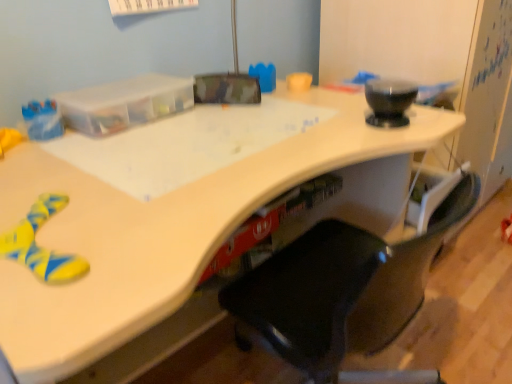
What do you see at coordinates (341, 289) in the screenshot? Image resolution: width=512 pixels, height=384 pixels. I see `black plastic chair at center` at bounding box center [341, 289].

Locate an element on the screen. white glossy desk at lower left is located at coordinates (165, 213).

Which of these two, white glossy desk at lower left or rubberized red toy at lower right, is smaller?

rubberized red toy at lower right.

From the picture: Are white glossy desk at lower left and rubberized red toy at lower right making contact?

They are not placed beside each other.

From the image's perspective, which is below, white glossy desk at lower left or rubberized red toy at lower right?

white glossy desk at lower left is shown below in the image.

From a real-world perspective, between rubberized red toy at lower right and black plastic chair at center, who is vertically lower?

rubberized red toy at lower right.

Which is in front, rubberized red toy at lower right or black plastic chair at center?

Positioned in front is black plastic chair at center.

Considering the points (504, 221) and (330, 263), which point is in front, point (504, 221) or point (330, 263)?

Point (330, 263)

How distant is rubberized red toy at lower right from black plastic chair at center?

rubberized red toy at lower right is 1.27 meters away from black plastic chair at center.

Is black plastic chair at center at the right side of white glossy desk at lower left?

No, black plastic chair at center is not to the right of white glossy desk at lower left.

Can you confirm if black plastic chair at center is shorter than white glossy desk at lower left?

In fact, black plastic chair at center may be taller than white glossy desk at lower left.

The image size is (512, 384). Find the location of `desk below the black plastic chair at center (from the image's perspective)`. desk below the black plastic chair at center (from the image's perspective) is located at coordinates (165, 213).

How many degrees apart are the facing directions of black plastic chair at center and white glossy desk at lower left?

The angular difference between black plastic chair at center and white glossy desk at lower left is 94 degrees.

Based on their sizes in the image, would you say rubberized red toy at lower right is bigger or smaller than white glossy desk at lower left?

In the image, rubberized red toy at lower right appears to be smaller than white glossy desk at lower left.

Is white glossy desk at lower left a part of rubberized red toy at lower right?

Actually, white glossy desk at lower left is outside rubberized red toy at lower right.

Is rubberized red toy at lower right to the left of white glossy desk at lower left from the viewer's perspective?

In fact, rubberized red toy at lower right is to the right of white glossy desk at lower left.

Identify the location of desk below the rubberized red toy at lower right (from the image's perspective). The width and height of the screenshot is (512, 384). (165, 213).

How many degrees apart are the facing directions of black plastic chair at center and rubberized red toy at lower right?

The facing directions of black plastic chair at center and rubberized red toy at lower right are 107 degrees apart.

Could rubberized red toy at lower right be considered to be inside black plastic chair at center?

Actually, rubberized red toy at lower right is outside black plastic chair at center.

Is black plastic chair at center to the right of rubberized red toy at lower right from the viewer's perspective?

In fact, black plastic chair at center is to the left of rubberized red toy at lower right.

Which point is more forward, (259, 296) or (507, 238)?

The point (259, 296) is closer.

In order to click on desk that is under the black plastic chair at center (from a real-world perspective) in this screenshot , I will do `click(165, 213)`.

From the image's perspective, is white glossy desk at lower left positioned above or below black plastic chair at center?

white glossy desk at lower left is below black plastic chair at center.

Is white glossy desk at lower left shorter than black plastic chair at center?

Yes, white glossy desk at lower left is shorter than black plastic chair at center.

From a real-world perspective, is white glossy desk at lower left over black plastic chair at center?

No.

Find the location of a particular element. This screenshot has height=384, width=512. toy that appears behind the white glossy desk at lower left is located at coordinates (507, 229).

Find the location of `toy to the right of black plastic chair at center`. toy to the right of black plastic chair at center is located at coordinates click(x=507, y=229).

Based on their spatial positions, is white glossy desk at lower left or rubberized red toy at lower right further from black plastic chair at center?

Among the two, rubberized red toy at lower right is located further to black plastic chair at center.

Estimate the real-world distances between objects in this image. Which object is further from white glossy desk at lower left, rubberized red toy at lower right or black plastic chair at center?

Among the two, rubberized red toy at lower right is located further to white glossy desk at lower left.

Considering their positions, is white glossy desk at lower left positioned further to rubberized red toy at lower right than black plastic chair at center?

white glossy desk at lower left lies further to rubberized red toy at lower right than the other object.

Which object lies nearer to the anchor point rubberized red toy at lower right, black plastic chair at center or white glossy desk at lower left?

black plastic chair at center is positioned closer to the anchor rubberized red toy at lower right.

From the image, which object appears to be nearer to black plastic chair at center, rubberized red toy at lower right or white glossy desk at lower left?

white glossy desk at lower left is closer to black plastic chair at center.

When comparing their distances from white glossy desk at lower left, does black plastic chair at center or rubberized red toy at lower right seem further?

rubberized red toy at lower right is positioned further to the anchor white glossy desk at lower left.

Identify the location of desk positioned between black plastic chair at center and rubberized red toy at lower right from near to far. The height and width of the screenshot is (384, 512). (165, 213).